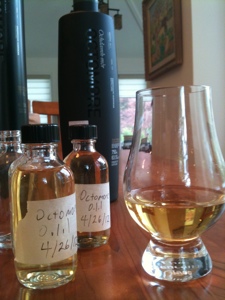
Locate an element on the screen. This screenshot has height=300, width=225. glass is located at coordinates (168, 263).